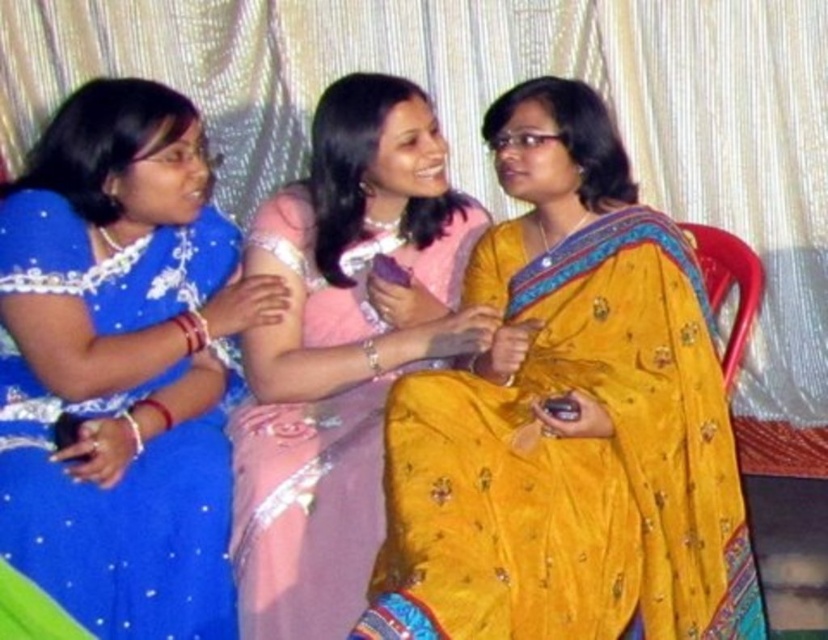
Question: Can you confirm if yellow satin saree at center is positioned above pink satin saree at center?

Choices:
 (A) no
 (B) yes

Answer: (A)

Question: Estimate the real-world distances between objects in this image. Which object is farther from the matte blue saree at left?

Choices:
 (A) plastic chair at right
 (B) pink satin saree at center

Answer: (A)

Question: Can you confirm if pink satin saree at center is positioned to the left of plastic chair at right?

Choices:
 (A) yes
 (B) no

Answer: (A)

Question: Considering the real-world distances, which object is farthest from the matte blue saree at left?

Choices:
 (A) pink satin saree at center
 (B) plastic chair at right

Answer: (B)

Question: Can you confirm if matte blue saree at left is positioned above pink satin saree at center?

Choices:
 (A) yes
 (B) no

Answer: (A)

Question: Which point is closer to the camera taking this photo?

Choices:
 (A) (352, 445)
 (B) (705, 284)
 (C) (25, 369)
 (D) (391, 545)

Answer: (D)